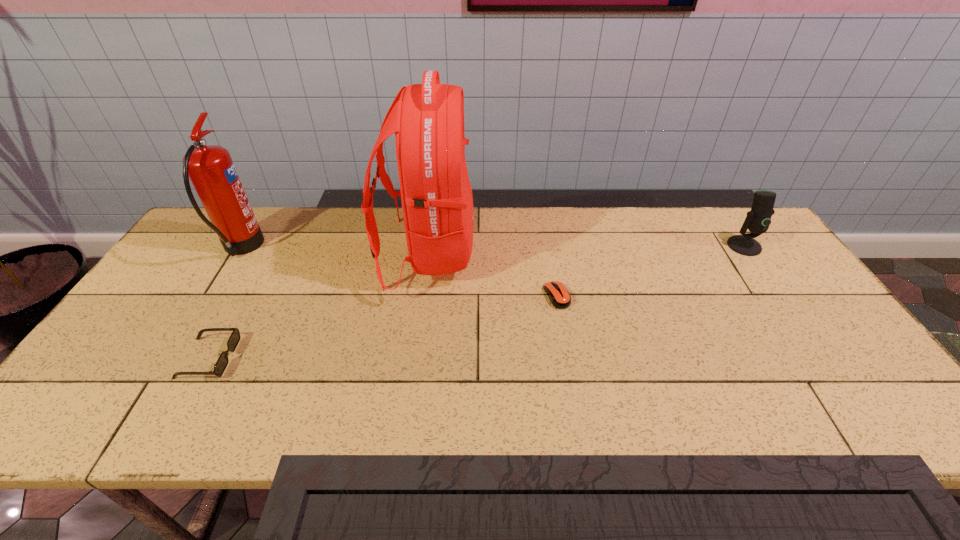
Image resolution: width=960 pixels, height=540 pixels. What are the coordinates of `vacant space located 0.150m on the surface of the second tallest object` in the screenshot? It's located at (309, 248).

I want to click on vacant space located on the left of the third tallest object, so click(x=703, y=246).

Find the location of `vacant point located 0.100m on the front-facing side of the sunglasses`. vacant point located 0.100m on the front-facing side of the sunglasses is located at coordinates (276, 358).

Where is `free point located on the left of the second object from right to left`? free point located on the left of the second object from right to left is located at coordinates click(x=453, y=296).

This screenshot has width=960, height=540. I want to click on backpack situated at the far edge, so click(428, 119).

You are a GUI agent. You are given a task and a screenshot of the screen. Output one action in this format:
    pyautogui.click(x=<x>, y=<y>)
    Task: Click on the fire extinguisher present at the far edge
    
    Given the screenshot: What is the action you would take?
    pyautogui.click(x=211, y=170)

What are the coordinates of `microphone at the far edge` in the screenshot? It's located at (757, 221).

Where is `object at the left edge`? Image resolution: width=960 pixels, height=540 pixels. object at the left edge is located at coordinates (211, 170).

This screenshot has height=540, width=960. I want to click on object at the right edge, so click(757, 221).

Where is `object that is at the far left corner`? The image size is (960, 540). object that is at the far left corner is located at coordinates (211, 170).